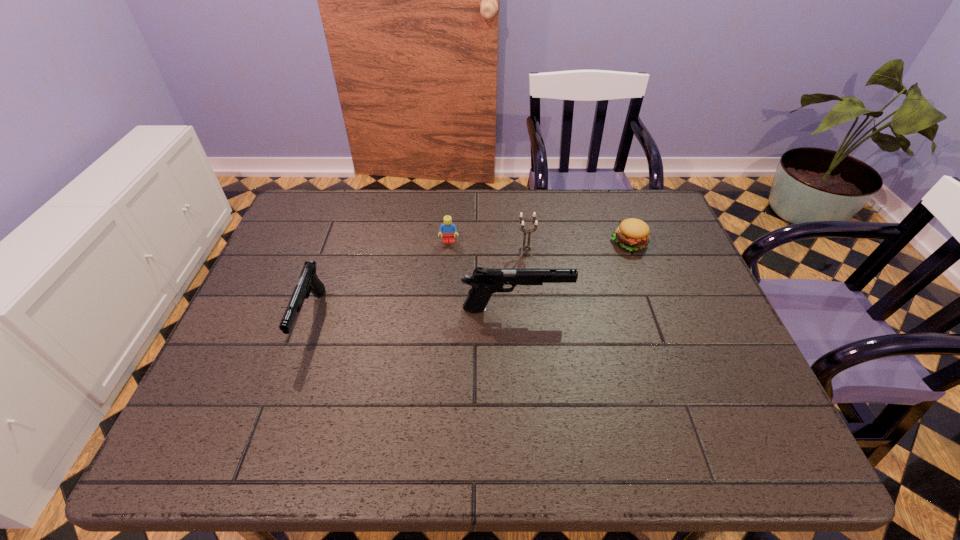
At what (x,y) coordinates should I click in order to perform the action: click on free space located 0.070m on the front of the shortest object. Please return your answer as a coordinate pair (x, y). Image resolution: width=960 pixels, height=540 pixels. Looking at the image, I should click on (639, 272).

I want to click on vacant point located on the face of the Lego, so click(447, 256).

The height and width of the screenshot is (540, 960). Identify the location of free space located 0.290m on the back of the candle holder. (518, 190).

Locate an element on the screen. Image resolution: width=960 pixels, height=540 pixels. object that is positioned at the far edge is located at coordinates (632, 234).

The width and height of the screenshot is (960, 540). What are the coordinates of `object that is at the left edge` in the screenshot? It's located at (309, 282).

Locate an element on the screen. The height and width of the screenshot is (540, 960). object present at the right edge is located at coordinates (632, 234).

The width and height of the screenshot is (960, 540). Find the location of `object present at the far right corner`. object present at the far right corner is located at coordinates (632, 234).

Where is `blank space at the far edge of the desktop`? blank space at the far edge of the desktop is located at coordinates (416, 198).

Image resolution: width=960 pixels, height=540 pixels. I want to click on vacant region at the left edge of the desktop, so pos(293,247).

Where is `free point at the right edge`? Image resolution: width=960 pixels, height=540 pixels. free point at the right edge is located at coordinates coord(696,306).